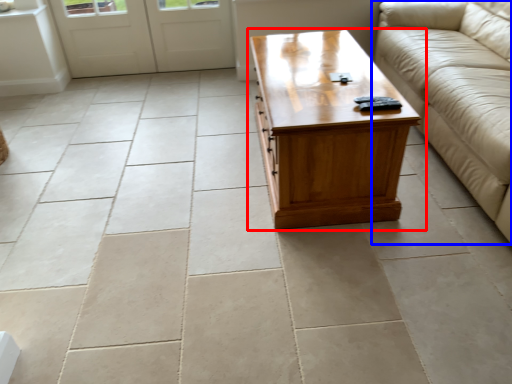
Question: Which object appears farthest to the camera in this image, coffee table (highlighted by a red box) or studio couch (highlighted by a blue box)?

Choices:
 (A) coffee table
 (B) studio couch

Answer: (A)